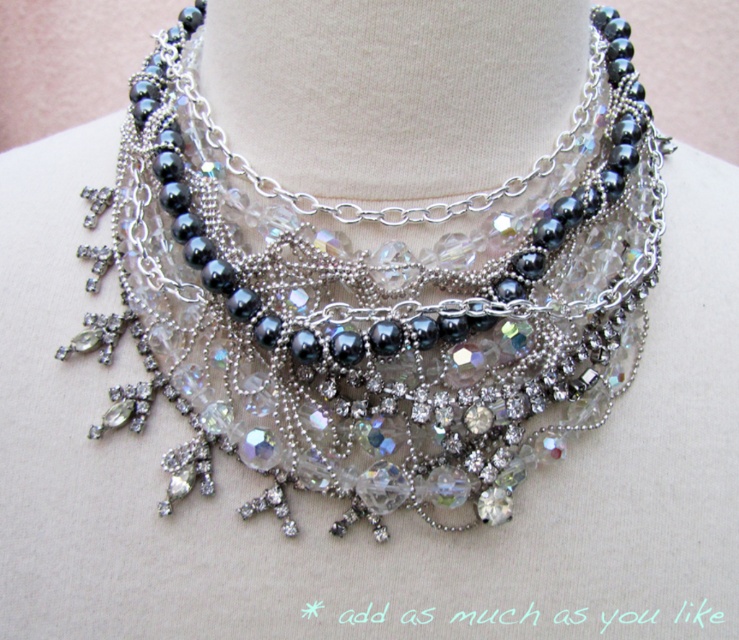
Does swarovski crystal necklace at center have a greater height compared to clear crystal necklace at center?

Correct, swarovski crystal necklace at center is much taller as clear crystal necklace at center.

Can you confirm if swarovski crystal necklace at center is positioned above clear crystal necklace at center?

No.

The width and height of the screenshot is (739, 640). What are the coordinates of `swarovski crystal necklace at center` in the screenshot? It's located at (378, 301).